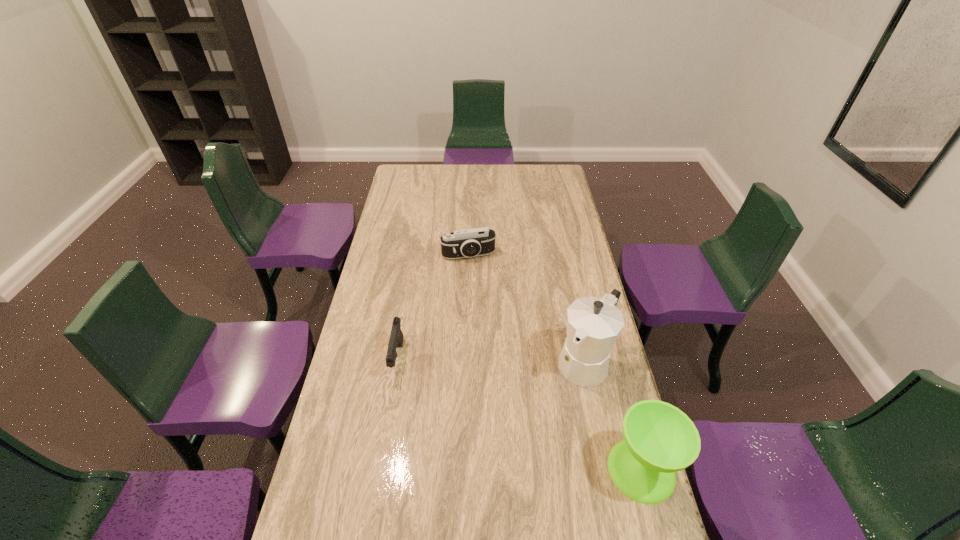
The image size is (960, 540). In order to click on free space located at the spout of the tallest object in this screenshot , I will do `click(542, 422)`.

Locate an element on the screen. The width and height of the screenshot is (960, 540). free space located 0.240m on the front lens of the farthest object is located at coordinates (486, 304).

Image resolution: width=960 pixels, height=540 pixels. What are the coordinates of `vacant space situated 0.140m on the front lens of the farthest object` in the screenshot? It's located at (481, 286).

Image resolution: width=960 pixels, height=540 pixels. In order to click on free space located 0.320m on the front lens of the farthest object in this screenshot , I will do `click(491, 319)`.

Identify the location of object that is positioned at the left edge. The height and width of the screenshot is (540, 960). (396, 337).

The height and width of the screenshot is (540, 960). I want to click on wineglass that is at the right edge, so (659, 439).

Locate an element on the screen. coffeepot located in the right edge section of the desktop is located at coordinates pos(593,324).

The height and width of the screenshot is (540, 960). What are the coordinates of `vacant space at the far edge of the desktop` in the screenshot? It's located at (494, 175).

This screenshot has height=540, width=960. I want to click on free space at the left edge of the desktop, so click(344, 449).

Locate an element on the screen. vacant space at the right edge of the desktop is located at coordinates (553, 262).